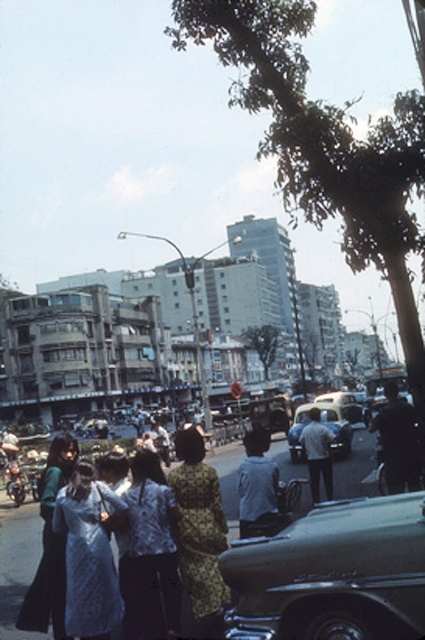
Question: Among these points, which one is farthest from the camera?

Choices:
 (A) (204, 524)
 (B) (291, 449)
 (C) (73, 492)
 (D) (153, 611)

Answer: (B)

Question: Among these objects, which one is farthest from the camera?

Choices:
 (A) patterned fabric dress at center
 (B) printed fabric blouse at center
 (C) shiny black car at center
 (D) silky blue dress at center

Answer: (B)

Question: Which point is farther from the camera taking this photo?

Choices:
 (A) (181, 497)
 (B) (73, 552)
 (C) (152, 564)

Answer: (A)

Question: Observing the image, what is the correct spatial positioning of silky white dress at lower left in reference to metallic silver car at center?

Choices:
 (A) right
 (B) left

Answer: (B)

Question: Does silky blue dress at center appear on the left side of patterned fabric dress at center?

Choices:
 (A) no
 (B) yes

Answer: (B)

Question: Can you confirm if printed fabric blouse at center is positioned to the right of silky white dress at lower left?

Choices:
 (A) yes
 (B) no

Answer: (A)